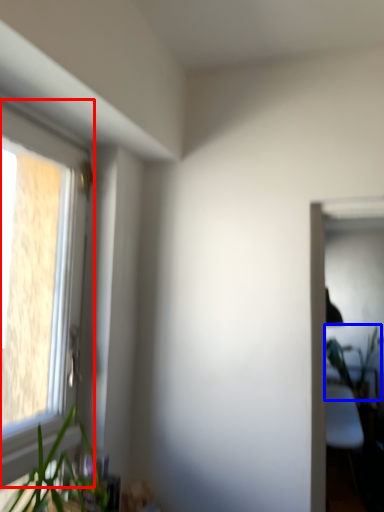
Question: Among these objects, which one is nearest to the camera, window (highlighted by a red box) or vegetation (highlighted by a blue box)?

Choices:
 (A) window
 (B) vegetation

Answer: (A)